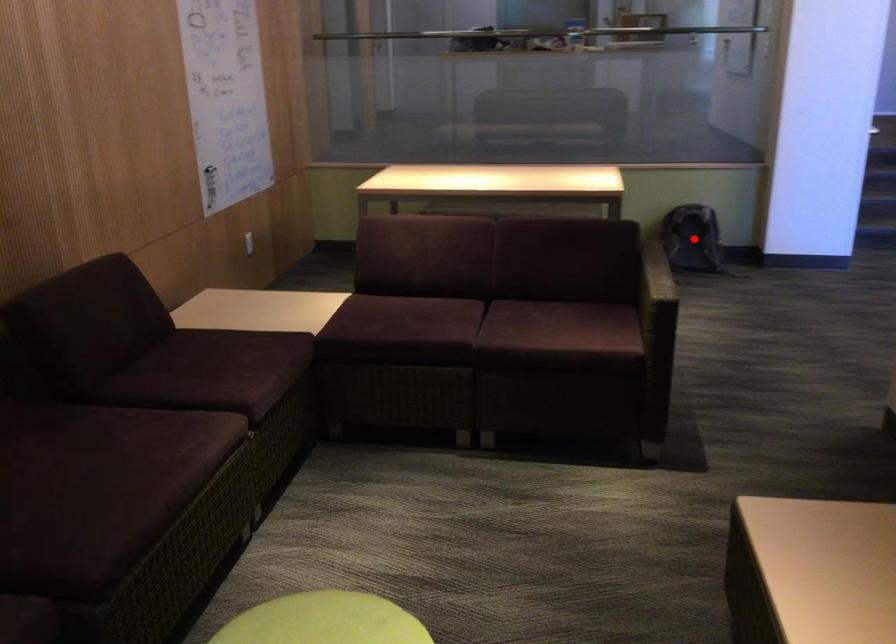
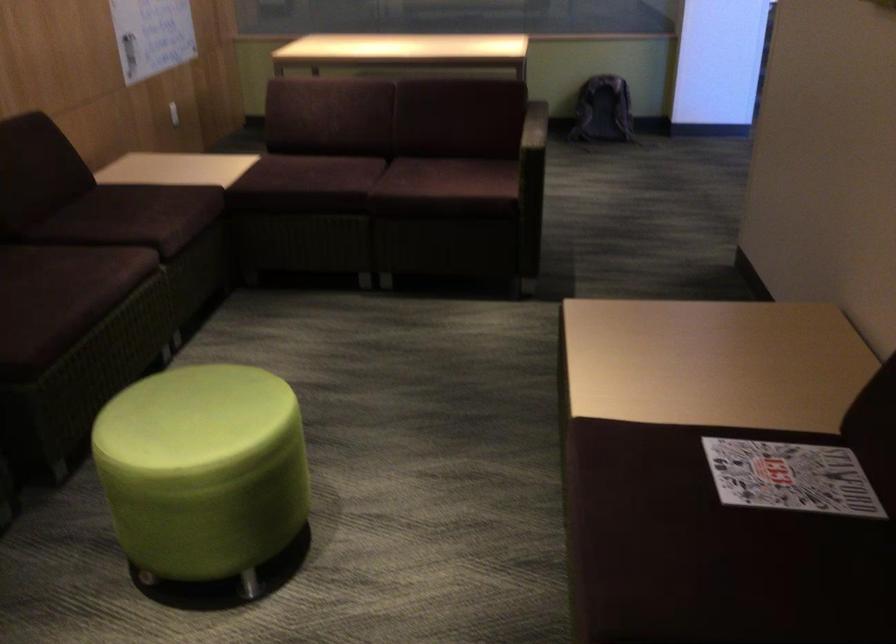
Where in the second image is the point corresponding to the highlighted location from the first image?

(602, 109)